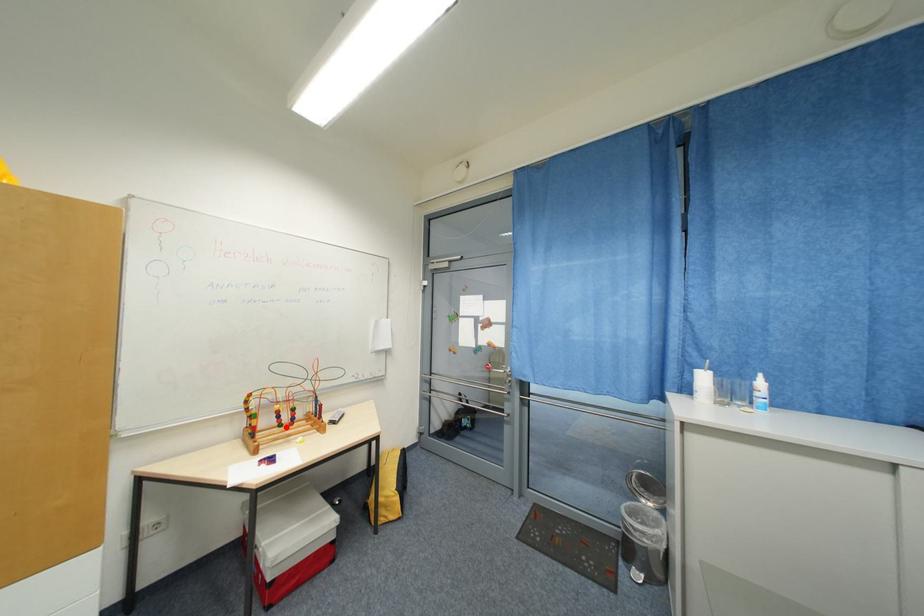
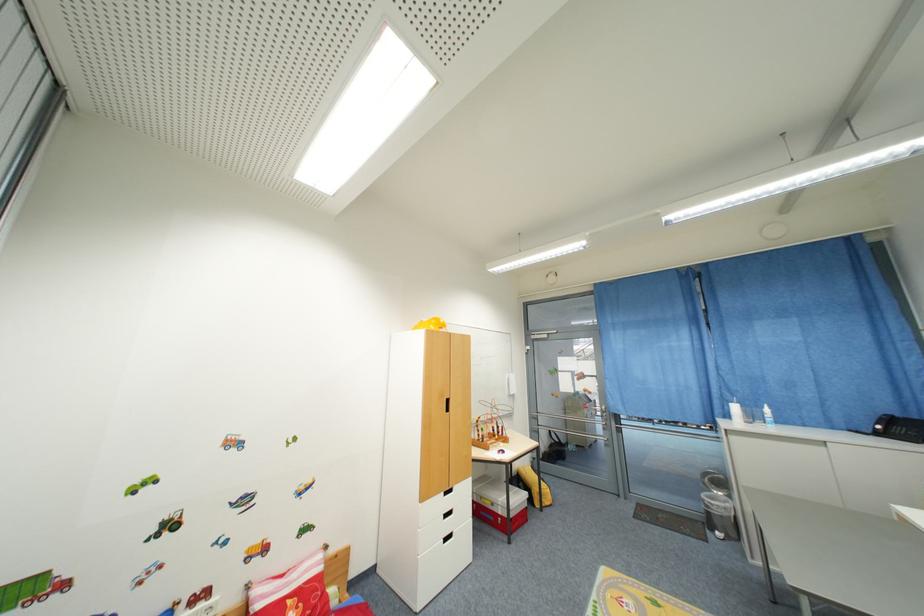
Find the pixel in the second image that matches the highlighted location in the first image.

(500, 438)